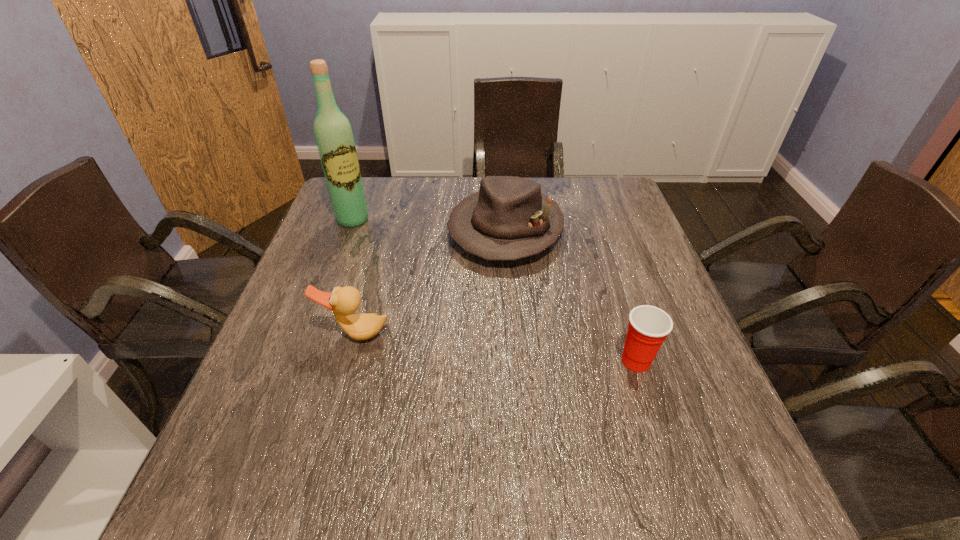
At what (x,y) coordinates should I click in order to perform the action: click on duck. Please return your answer as a coordinate pair (x, y). Looking at the image, I should click on (343, 302).

You are a GUI agent. You are given a task and a screenshot of the screen. Output one action in this format:
    pyautogui.click(x=<x>, y=<y>)
    Task: Click on the nearest object
    
    Given the screenshot: What is the action you would take?
    pyautogui.click(x=648, y=327)

This screenshot has width=960, height=540. What are the coordinates of `the rightmost object` in the screenshot? It's located at (648, 327).

Identify the location of the third object from left to right. (509, 218).

Identify the location of the tallest object. (333, 134).

Image resolution: width=960 pixels, height=540 pixels. Find the location of `vacant area situated 0.050m on the beak of the third farthest object`. vacant area situated 0.050m on the beak of the third farthest object is located at coordinates (348, 364).

Locate an element on the screen. blank area located on the right of the Dixie cup is located at coordinates (689, 361).

At what (x,y) coordinates should I click in order to perform the action: click on vacant space situated on the decorative side of the third object from left to right. Please return your answer as a coordinate pair (x, y). This screenshot has width=960, height=540. Looking at the image, I should click on (454, 349).

Locate an element on the screen. vacant point located 0.300m on the decorative side of the third object from left to right is located at coordinates (449, 360).

The height and width of the screenshot is (540, 960). In order to click on vacant space situated on the decorative side of the third object from left to right in this screenshot , I will do `click(477, 299)`.